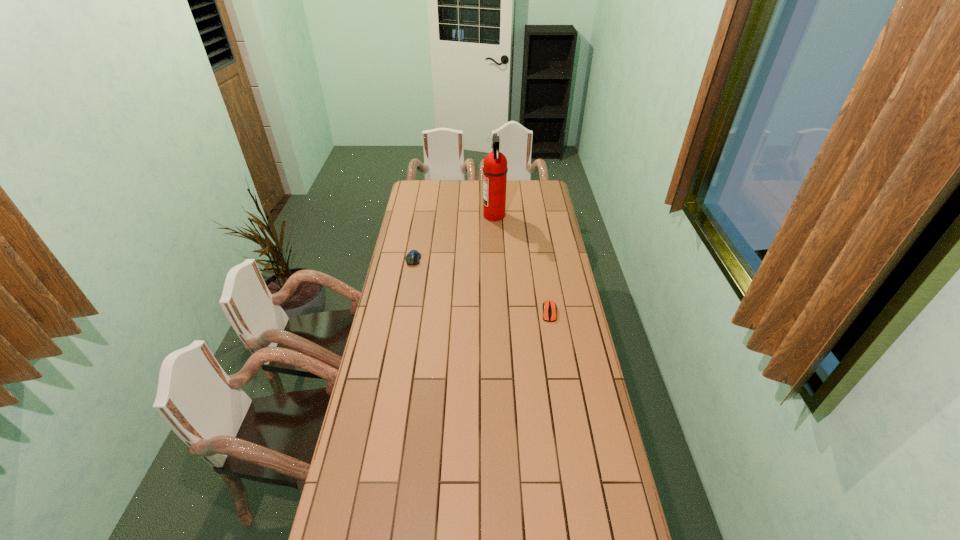
Locate an element on the screen. This screenshot has width=960, height=540. free space that is in between the farther computer mouse and the farthest object is located at coordinates 453,237.

Where is `unoccupied position between the nearer computer mouse and the farther computer mouse`? unoccupied position between the nearer computer mouse and the farther computer mouse is located at coordinates (481, 286).

Image resolution: width=960 pixels, height=540 pixels. Find the location of `free space between the nearer computer mouse and the second farthest object`. free space between the nearer computer mouse and the second farthest object is located at coordinates (481, 286).

Find the location of a particular element. object that is the second closest to the farther computer mouse is located at coordinates (549, 307).

Point out which object is positioned as the second nearest to the nearest object. Please provide its 2D coordinates. Your answer should be formatted as a tuple, i.e. [(x, y)], where the tuple contains the x and y coordinates of a point satisfying the conditions above.

[(495, 169)]

The width and height of the screenshot is (960, 540). I want to click on vacant space that satisfies the following two spatial constraints: 1. on the button side of the leftmost object; 2. on the left side of the nearer computer mouse, so click(x=403, y=312).

I want to click on vacant space that satisfies the following two spatial constraints: 1. on the button side of the nearer computer mouse; 2. on the right side of the left computer mouse, so click(403, 312).

The width and height of the screenshot is (960, 540). In order to click on vacant space that satisfies the following two spatial constraints: 1. on the back side of the nearer computer mouse; 2. on the side of the tallest object near the handle in this screenshot , I will do `click(533, 215)`.

The width and height of the screenshot is (960, 540). I want to click on vacant space that satisfies the following two spatial constraints: 1. on the side of the farthest object near the handle; 2. on the button side of the farther computer mouse, so click(x=496, y=259).

At what (x,y) coordinates should I click in order to perform the action: click on free space that satisfies the following two spatial constraints: 1. on the side of the second object from right to left near the handle; 2. on the back side of the nearer computer mouse. Please return your answer as a coordinate pair (x, y). The width and height of the screenshot is (960, 540). Looking at the image, I should click on (498, 312).